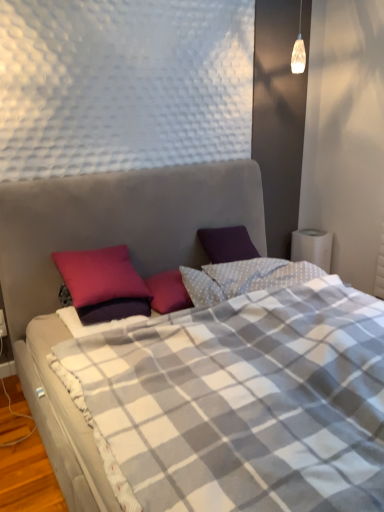
Question: Can you confirm if white plastic electric outlet at lower left is positioned to the left of plaid fabric bed at center?

Choices:
 (A) no
 (B) yes

Answer: (B)

Question: Is white plastic electric outlet at lower left in contact with plaid fabric bed at center?

Choices:
 (A) no
 (B) yes

Answer: (A)

Question: Is white plastic electric outlet at lower left taller than plaid fabric bed at center?

Choices:
 (A) no
 (B) yes

Answer: (A)

Question: Is plaid fabric bed at center surrounded by white plastic electric outlet at lower left?

Choices:
 (A) no
 (B) yes

Answer: (A)

Question: Considering the relative sizes of white plastic electric outlet at lower left and plaid fabric bed at center in the image provided, is white plastic electric outlet at lower left wider than plaid fabric bed at center?

Choices:
 (A) yes
 (B) no

Answer: (B)

Question: From the image's perspective, would you say white plastic electric outlet at lower left is shown under plaid fabric bed at center?

Choices:
 (A) yes
 (B) no

Answer: (A)

Question: Considering the relative sizes of purple matte pillow at upper left and white plastic electric outlet at lower left in the image provided, is purple matte pillow at upper left thinner than white plastic electric outlet at lower left?

Choices:
 (A) no
 (B) yes

Answer: (A)

Question: Can you confirm if purple matte pillow at upper left is smaller than white plastic electric outlet at lower left?

Choices:
 (A) yes
 (B) no

Answer: (B)

Question: Is purple matte pillow at upper left in contact with white plastic electric outlet at lower left?

Choices:
 (A) yes
 (B) no

Answer: (B)

Question: From a real-world perspective, is purple matte pillow at upper left positioned under white plastic electric outlet at lower left based on gravity?

Choices:
 (A) no
 (B) yes

Answer: (A)

Question: Does purple matte pillow at upper left have a greater width compared to white plastic electric outlet at lower left?

Choices:
 (A) no
 (B) yes

Answer: (B)

Question: From a real-world perspective, is purple matte pillow at upper left over white plastic electric outlet at lower left?

Choices:
 (A) yes
 (B) no

Answer: (A)

Question: Is purple matte pillow at upper left thinner than plaid fabric bed at center?

Choices:
 (A) no
 (B) yes

Answer: (B)